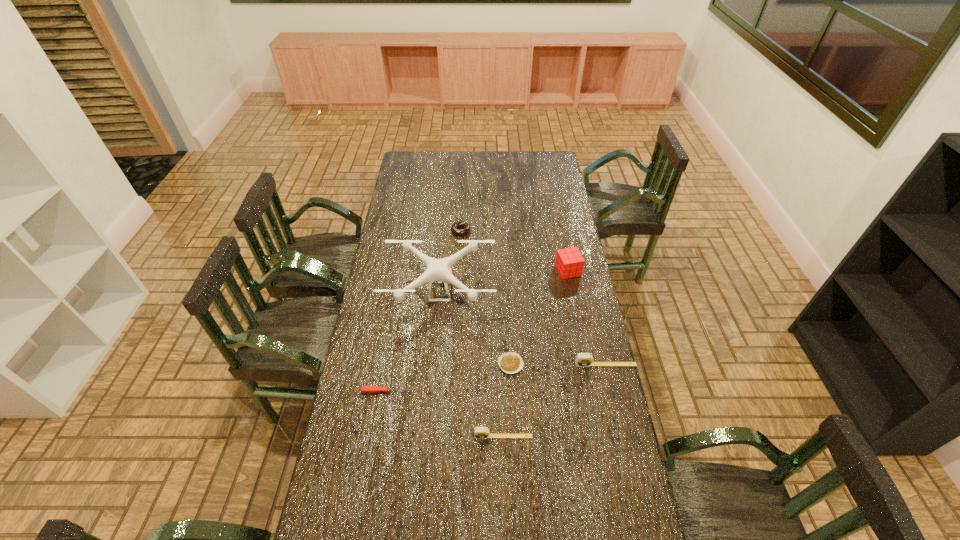
This screenshot has width=960, height=540. In order to click on the tallest object in this screenshot , I will do `click(437, 270)`.

Where is `free space located 0.210m at the front of the left tape measure with the tape extended`? Image resolution: width=960 pixels, height=540 pixels. free space located 0.210m at the front of the left tape measure with the tape extended is located at coordinates (506, 510).

This screenshot has height=540, width=960. Find the location of `vacant space located at the front of the fifth shortest object with the tape extended`. vacant space located at the front of the fifth shortest object with the tape extended is located at coordinates (614, 402).

This screenshot has width=960, height=540. Identify the location of free space located 0.400m on the front of the doughnut. (457, 300).

The width and height of the screenshot is (960, 540). Find the location of `free space located on the back of the cube`. free space located on the back of the cube is located at coordinates (559, 225).

In order to click on vacant area situated 0.090m on the left of the shortest object in this screenshot , I will do `click(473, 364)`.

The image size is (960, 540). I want to click on free location located at the tip of the screwdriver, so click(500, 392).

Identify the location of free location located on the top of the drone. The height and width of the screenshot is (540, 960). (433, 379).

Find the location of a particular element. screwdriver that is positioned at the left edge is located at coordinates pyautogui.click(x=364, y=389).

The image size is (960, 540). In order to click on drone that is at the left edge in this screenshot , I will do `click(437, 270)`.